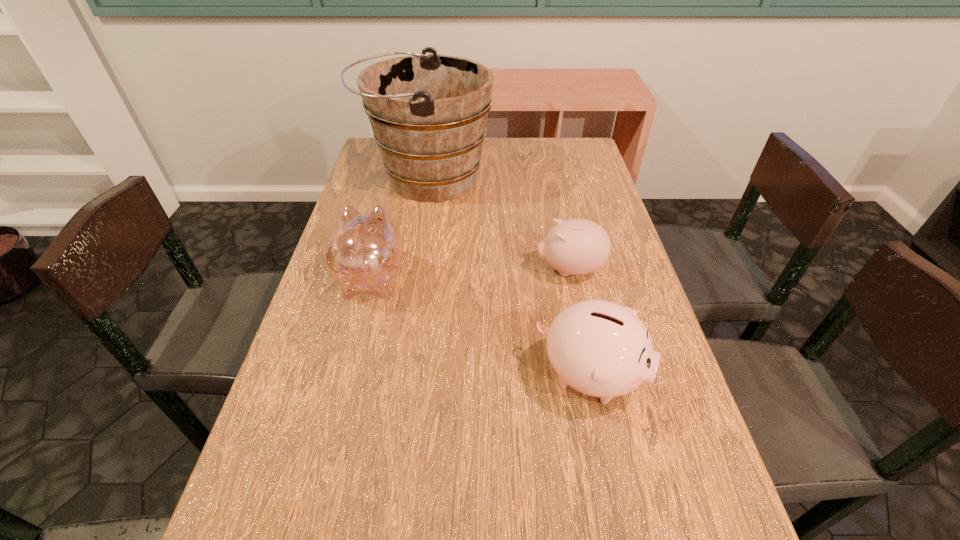
Find the location of `vacant space located 0.150m at the snout of the shortest piggy bank`. vacant space located 0.150m at the snout of the shortest piggy bank is located at coordinates (474, 269).

Locate an element on the screen. This screenshot has height=540, width=960. vacant space situated 0.110m at the snout of the shortest piggy bank is located at coordinates (491, 269).

The image size is (960, 540). I want to click on object positioned at the far edge, so click(428, 112).

At what (x,y) coordinates should I click in order to perform the action: click on bucket located in the left edge section of the desktop. Please return your answer as a coordinate pair (x, y). This screenshot has width=960, height=540. Looking at the image, I should click on (428, 112).

Locate an element on the screen. This screenshot has width=960, height=540. piggy bank located in the left edge section of the desktop is located at coordinates (364, 252).

At what (x,y) coordinates should I click in order to perform the action: click on object at the far left corner. Please return your answer as a coordinate pair (x, y). The height and width of the screenshot is (540, 960). Looking at the image, I should click on (428, 112).

In the image, there is a desktop. Where is `free region at the left edge`? The height and width of the screenshot is (540, 960). free region at the left edge is located at coordinates (341, 449).

This screenshot has width=960, height=540. I want to click on free space at the right edge, so click(592, 178).

At what (x,y) coordinates should I click in order to perform the action: click on free point at the far right corner. Please return your answer as a coordinate pair (x, y). Looking at the image, I should click on (565, 157).

Where is `free space between the farthest object and the nearest piggy bank`? The height and width of the screenshot is (540, 960). free space between the farthest object and the nearest piggy bank is located at coordinates (509, 276).